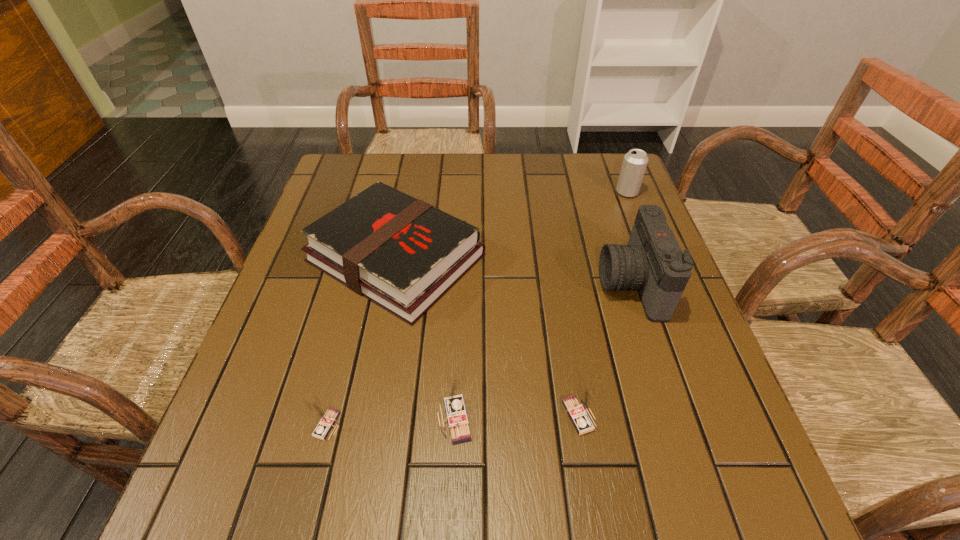
Find the location of a particular element. The height and width of the screenshot is (540, 960). vacant space located on the front of the hardback book is located at coordinates (361, 438).

This screenshot has height=540, width=960. I want to click on free spot located on the front of the beer can, so click(657, 267).

Find the location of a particular element. The width and height of the screenshot is (960, 540). vacant area situated at the lens of the camera is located at coordinates (468, 284).

The width and height of the screenshot is (960, 540). Find the location of `vacant area situated at the lens of the camera`. vacant area situated at the lens of the camera is located at coordinates (429, 284).

Locate an element on the screen. free spot located 0.310m at the lens of the camera is located at coordinates (465, 284).

This screenshot has width=960, height=540. I want to click on object at the far edge, so click(634, 164).

Identify the location of matchbox at the left edge. (326, 417).

Locate an element on the screen. The width and height of the screenshot is (960, 540). hardback book present at the left edge is located at coordinates (403, 254).

Identify the location of beer can that is at the right edge. The width and height of the screenshot is (960, 540). (634, 164).

Locate an element on the screen. Image resolution: width=960 pixels, height=540 pixels. camera positioned at the right edge is located at coordinates click(653, 263).